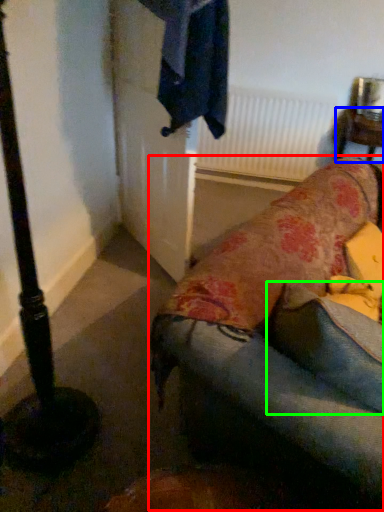
Question: Estimate the real-world distances between objects in this image. Which object is farther from studio couch (highlighted by a red box), furniture (highlighted by a blue box) or pillow (highlighted by a green box)?

Choices:
 (A) furniture
 (B) pillow

Answer: (A)